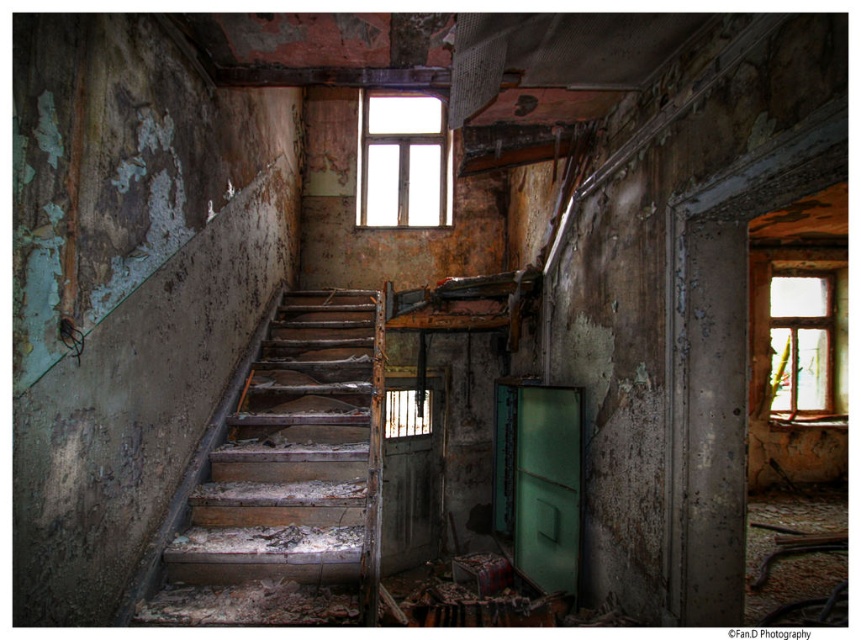
Based on the photo, can you confirm if wooden stairs at center is positioned to the left of green matte door at center-right?

Correct, you'll find wooden stairs at center to the left of green matte door at center-right.

The width and height of the screenshot is (861, 640). Describe the element at coordinates (287, 481) in the screenshot. I see `wooden stairs at center` at that location.

At what (x,y) coordinates should I click in order to perform the action: click on wooden stairs at center. Please return your answer as a coordinate pair (x, y). This screenshot has width=861, height=640. Looking at the image, I should click on (287, 481).

Locate an element on the screen. The width and height of the screenshot is (861, 640). wooden stairs at center is located at coordinates (287, 481).

Does wooden stairs at center come in front of rusty wooden door at center?

Yes.

Who is positioned more to the right, wooden stairs at center or rusty wooden door at center?

rusty wooden door at center

Is point (376, 490) more distant than point (437, 477)?

No, (376, 490) is closer to viewer.

Where is `wooden stairs at center`? This screenshot has width=861, height=640. wooden stairs at center is located at coordinates (287, 481).

Is point (574, 563) closer to viewer compared to point (372, 180)?

Yes, point (574, 563) is closer to viewer.

Describe the element at coordinates (547, 486) in the screenshot. This screenshot has height=640, width=861. I see `green matte door at center-right` at that location.

Locate an element on the screen. green matte door at center-right is located at coordinates (547, 486).